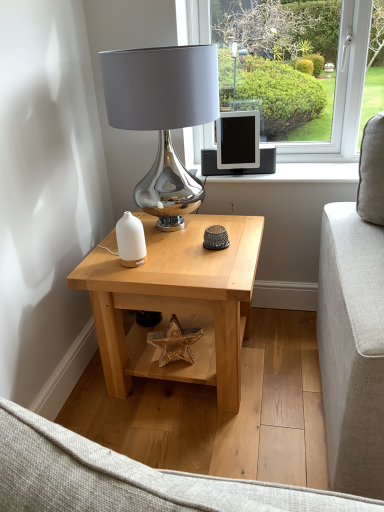
What are the coordinates of `free space in front of shiny metallic lamp at center` in the screenshot? It's located at (175, 266).